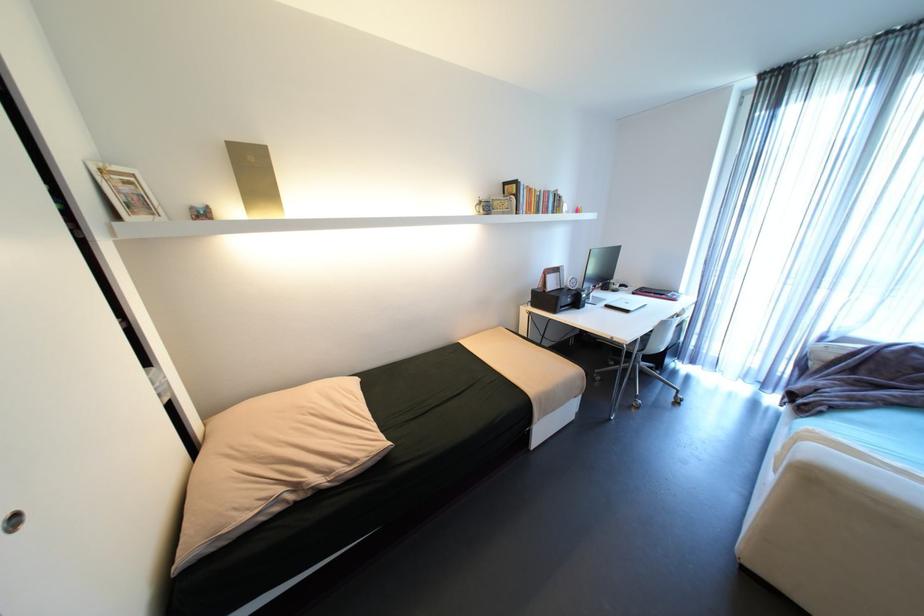
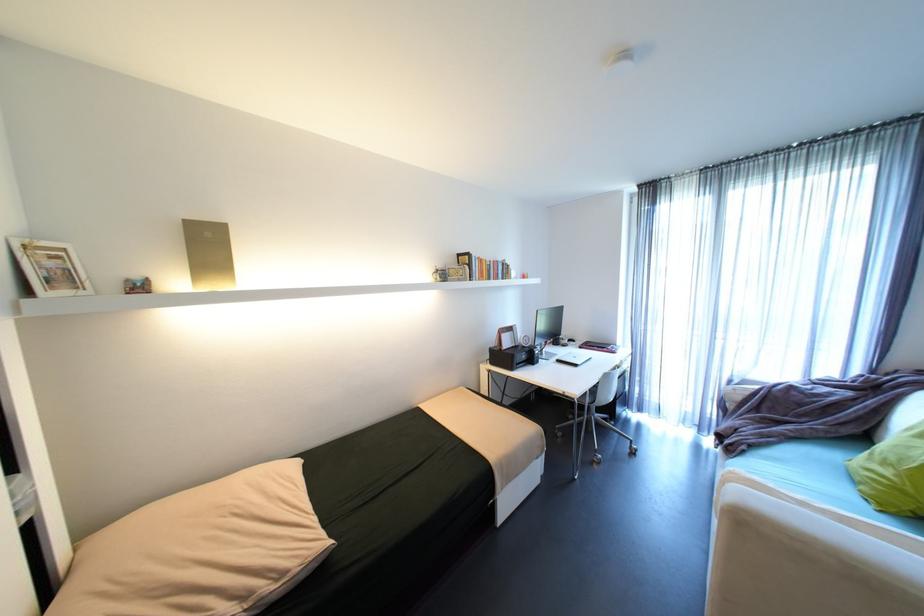
Locate, in the second image, the point that corresponds to (552,191) in the first image.

(500, 262)